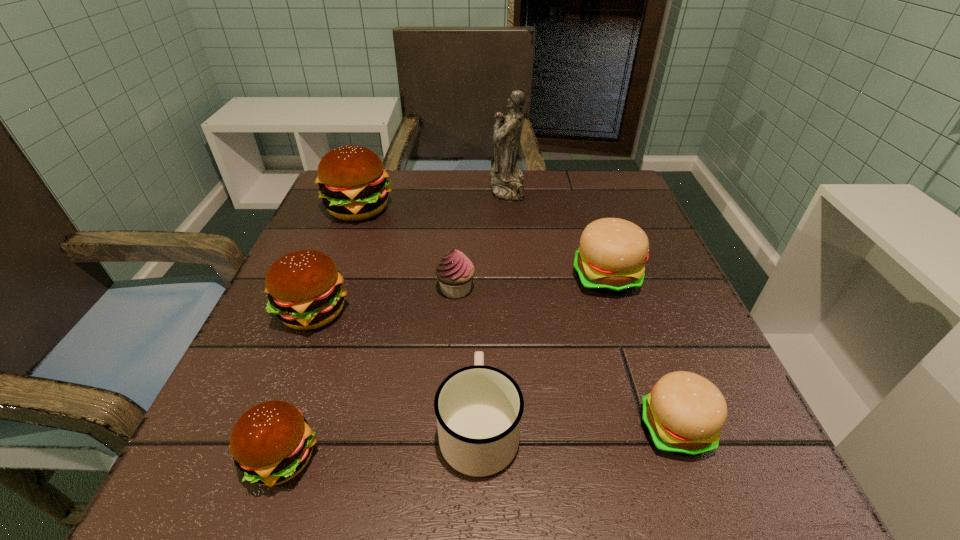
This screenshot has height=540, width=960. Find the location of `vacant space situated on the left of the nearer beige hamburger`. vacant space situated on the left of the nearer beige hamburger is located at coordinates (540, 429).

Identify the location of figurine that is at the far edge. The image size is (960, 540). (507, 183).

Find the location of a particular element. The width and height of the screenshot is (960, 540). hamburger positioned at the far edge is located at coordinates (352, 180).

Find the location of a particular element. mug present at the near edge is located at coordinates (478, 408).

Where is `object located in the far left corner section of the desktop`? object located in the far left corner section of the desktop is located at coordinates (352, 180).

Locate an element on the screen. This screenshot has width=960, height=540. object located at the near left corner is located at coordinates (271, 443).

Identify the location of object that is positioned at the near right corner. pos(684,413).

This screenshot has height=540, width=960. Identify the location of vacant position at the far edge of the desktop. (443, 177).

This screenshot has height=540, width=960. Find the location of `free space at the near edge`. free space at the near edge is located at coordinates (348, 447).

At what (x,y) coordinates should I click in order to perform the action: click on vacant area at the left edge. Please return your answer as a coordinate pair (x, y). Looking at the image, I should click on (332, 247).